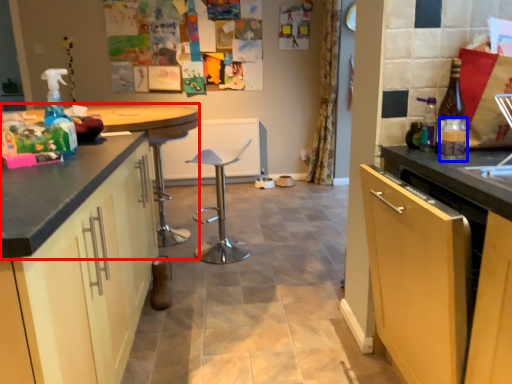
Question: Among these objects, which one is nearest to the camera, countertop (highlighted by a red box) or bottle (highlighted by a blue box)?

Choices:
 (A) countertop
 (B) bottle

Answer: (B)